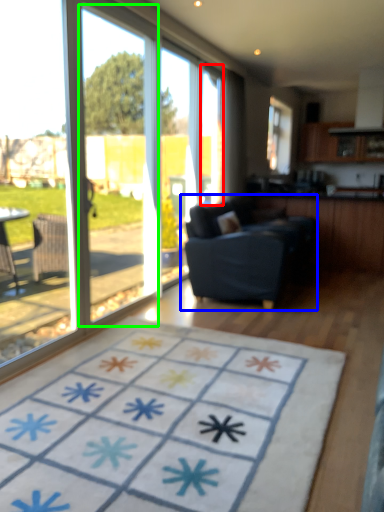
Question: Considering the real-world distances, which object is closest to window screen (highlighted by a red box)? studio couch (highlighted by a blue box) or screen door (highlighted by a green box).

Choices:
 (A) studio couch
 (B) screen door

Answer: (A)